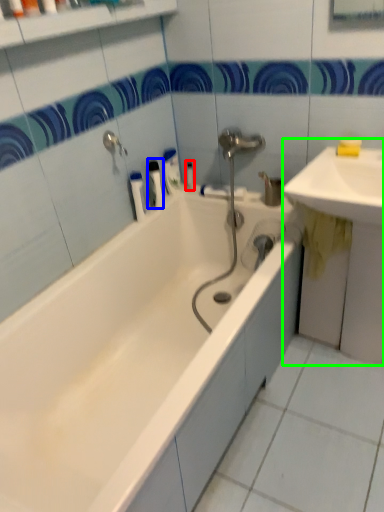
Question: Which object is positioned closest to toiletry (highlighted by a red box)? Select from toiletry (highlighted by a blue box) and sink (highlighted by a green box).

Choices:
 (A) toiletry
 (B) sink

Answer: (A)